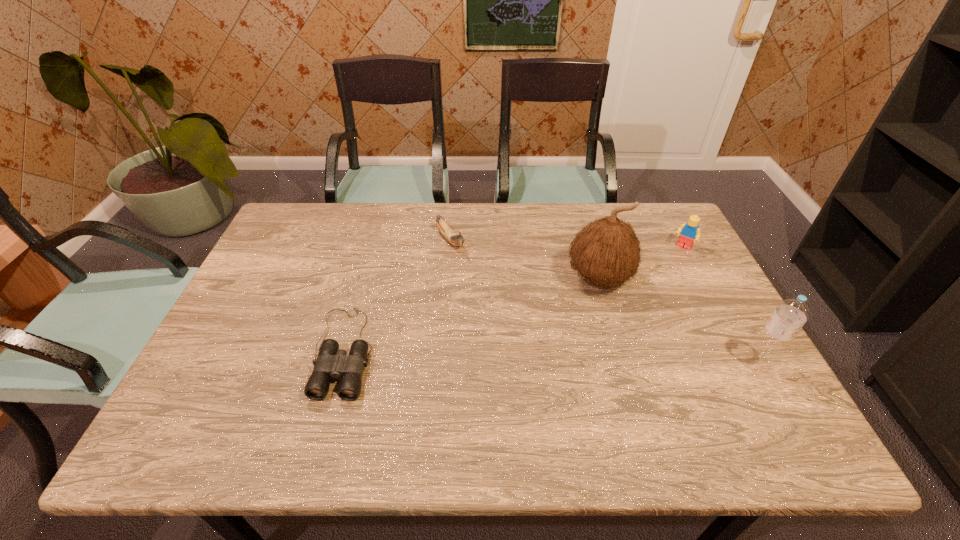
Locate an element on the screen. free space on the desktop that is between the leftmost object and the fourth shortest object and is positioned on the peel of the second object from left to right is located at coordinates (555, 357).

Where is `free spot on the desktop that is between the binoculars and the second tallest object and is positioned on the surface of the coconut`? free spot on the desktop that is between the binoculars and the second tallest object and is positioned on the surface of the coconut is located at coordinates (529, 356).

I want to click on vacant space on the desktop that is between the binoculars and the second tallest object and is positioned on the front-facing side of the Lego, so click(x=608, y=359).